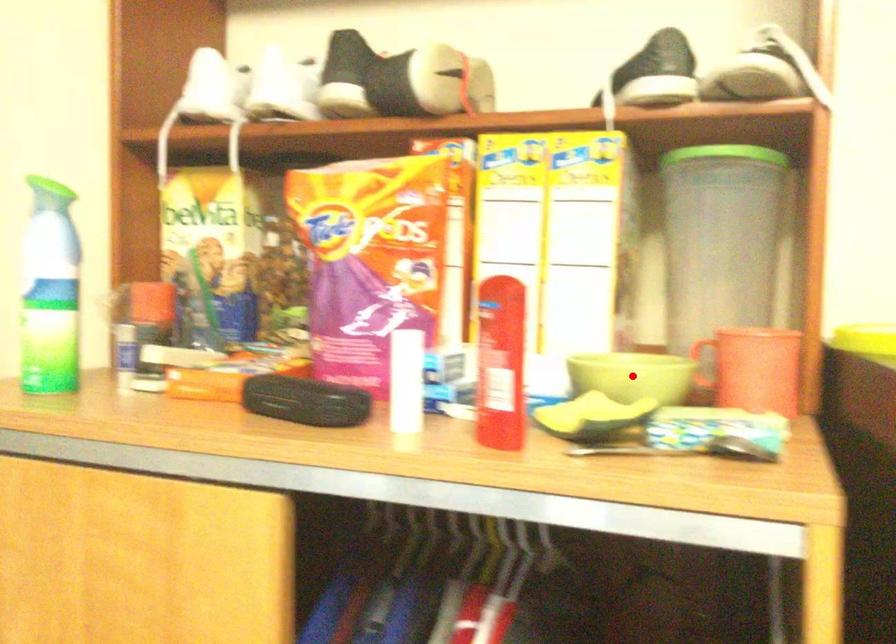
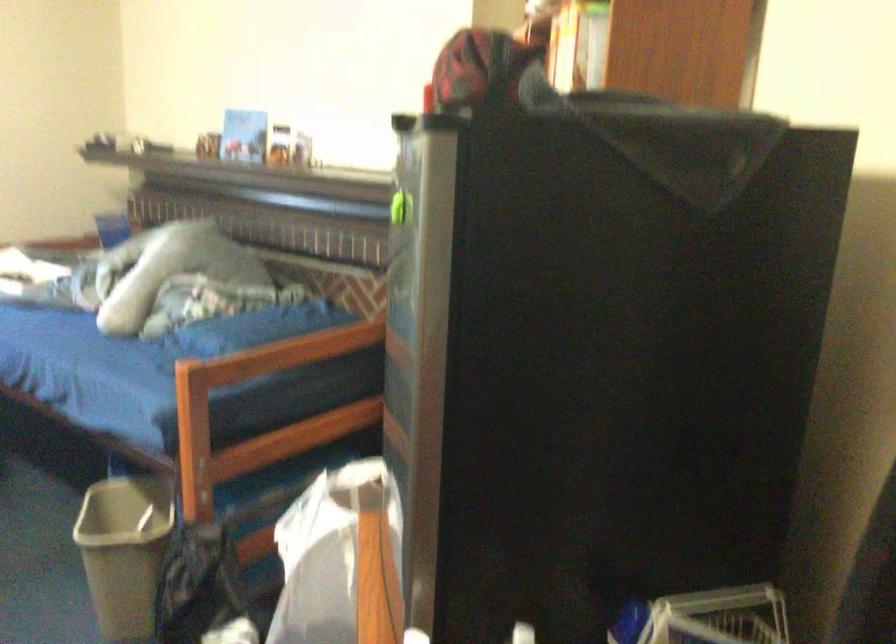
Question: I am providing you with two images of the same scene from different viewpoints. A red point is marked on the first image. Is the red point's position out of view in image 2?

Choices:
 (A) Yes
 (B) No

Answer: (A)